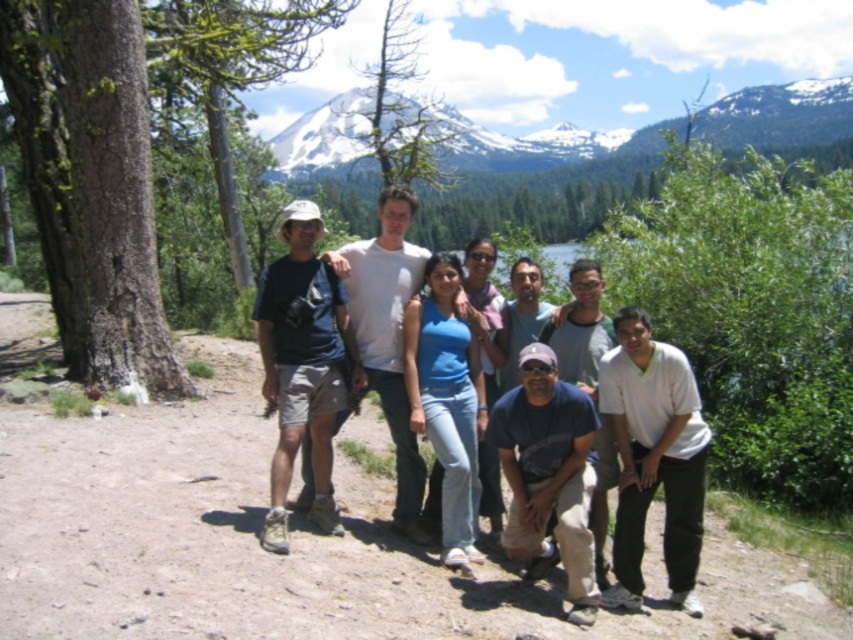
Question: Which point is farther to the camera?

Choices:
 (A) (689, 509)
 (B) (325, 516)
 (C) (440, 440)
 (D) (550, 484)

Answer: (C)

Question: Does white cotton shirt at lower right have a greater width compared to matte black shirt at center?

Choices:
 (A) no
 (B) yes

Answer: (A)

Question: Which of the following is the farthest from the observer?

Choices:
 (A) matte black shirt at center
 (B) matte blue shirt at center

Answer: (A)

Question: Can you confirm if matte blue shirt at center is positioned to the left of matte black shirt at center?

Choices:
 (A) yes
 (B) no

Answer: (B)

Question: Does white cotton shirt at lower right appear over blue denim jeans at center?

Choices:
 (A) no
 (B) yes

Answer: (A)

Question: Among these objects, which one is farthest from the camera?

Choices:
 (A) matte blue shirt at center
 (B) white cotton shirt at lower right
 (C) blue denim jeans at center
 (D) matte black shirt at center

Answer: (B)